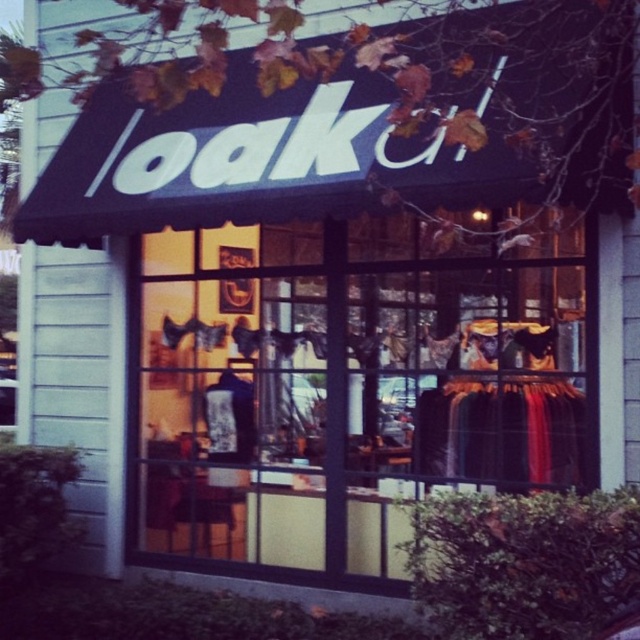
Looking at this image, you are a customer standing outside the boutique and want to see the black fabric dress at center displayed inside the transparent glass shop window at center. Can you see the entire dress through the window?

The transparent glass shop window at center is larger in size than black fabric dress at center, so yes, you can see the entire dress through the window.

You are a window dresser trying to place the black fabric dress at center inside the transparent glass shop window at center. Can the dress fit horizontally within the window?

The transparent glass shop window at center is wider than the black fabric dress at center, so the dress can fit horizontally within the window.

You are standing in front of the boutique named Oak. There is a point marked at coordinates (348, 385). Based on the scene description, where is this point located?

The point (348, 385) is on the transparent glass shop window at center.